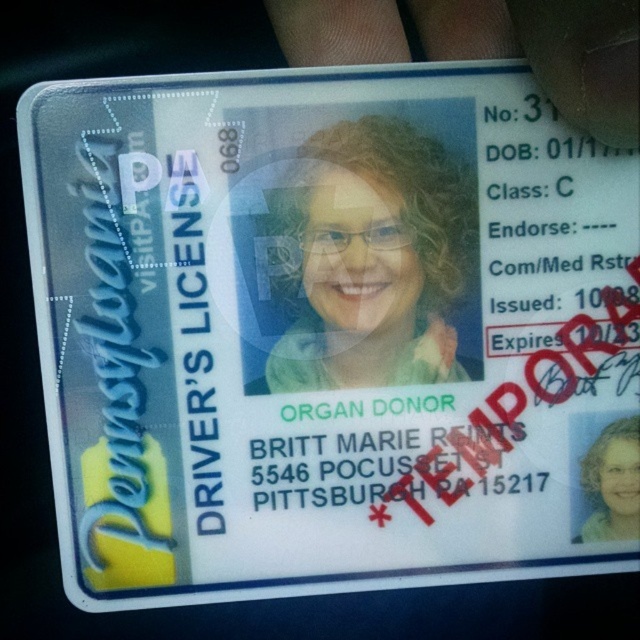
Question: Is matte plastic photo at center to the left of transparent plastic hand at upper center from the viewer's perspective?

Choices:
 (A) yes
 (B) no

Answer: (A)

Question: Does matte plastic photo at center appear on the left side of transparent plastic hand at upper center?

Choices:
 (A) yes
 (B) no

Answer: (A)

Question: Does transparent plastic hand at upper center have a larger size compared to light brown hair at center?

Choices:
 (A) no
 (B) yes

Answer: (B)

Question: Estimate the real-world distances between objects in this image. Which object is farther from the transparent plastic hand at upper center?

Choices:
 (A) light brown hair at center
 (B) matte plastic photo at center

Answer: (A)

Question: Based on their relative distances, which object is farther from the light brown hair at center?

Choices:
 (A) matte plastic photo at center
 (B) transparent plastic hand at upper center

Answer: (B)

Question: Which point is farther from the camera taking this photo?

Choices:
 (A) (637, 132)
 (B) (586, 529)
 (C) (336, 257)

Answer: (B)